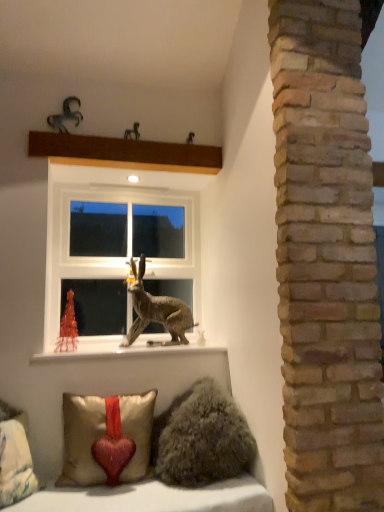
Locate an element on the screen. The image size is (384, 512). free space in front of satin gold pillow with red heart at lower left, the second pillow from the left is located at coordinates (102, 502).